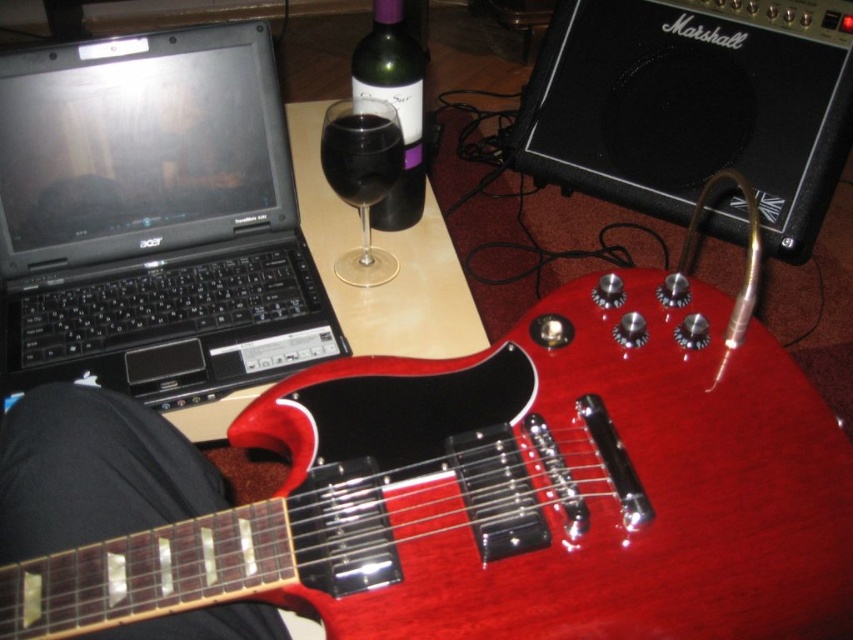
You are a photographer setting up a shoot in this scene. You want to focus on the glossy wood guitar at center and the black matte laptop at upper left. Which object should you adjust your camera focus on first if you want to ensure both are in focus, considering their positions?

The glossy wood guitar at center is closer to the viewer than the black matte laptop at upper left, so you should focus on the glossy wood guitar at center first to ensure depth of field covers both objects.

You are setting up a display for a music store and need to arrange the glossy wood guitar at center and the black matte laptop at upper left. According to the spatial relationship, which object should be placed first if you want to follow the rule that shorter items are positioned before taller ones?

The glossy wood guitar at center should be placed first because it is shorter than the black matte laptop at upper left, following the rule of positioning shorter items before taller ones.

You are a bartender preparing drinks and need to reach for the transparent glass at upper center and the green glass bottle at center. Which one do you need to extend your arm further to reach?

The transparent glass at upper center is closer to the viewer than the green glass bottle at center, so you need to extend your arm further to reach the green glass bottle at center.